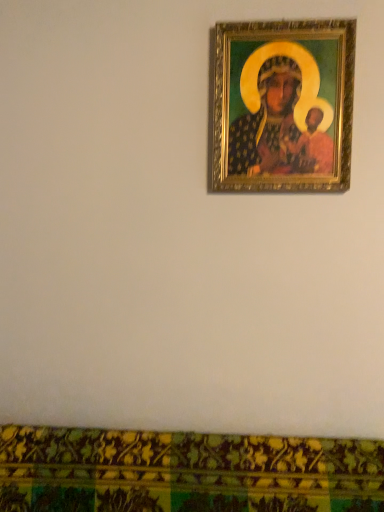
The image size is (384, 512). Describe the element at coordinates (283, 106) in the screenshot. I see `gold metallic picture frame at upper center` at that location.

Measure the distance between gold metallic picture frame at upper center and camera.

gold metallic picture frame at upper center and camera are 4.99 feet apart.

Locate an element on the screen. gold metallic picture frame at upper center is located at coordinates (283, 106).

At what (x,y) coordinates should I click in order to perform the action: click on gold metallic picture frame at upper center. Please return your answer as a coordinate pair (x, y). Looking at the image, I should click on (283, 106).